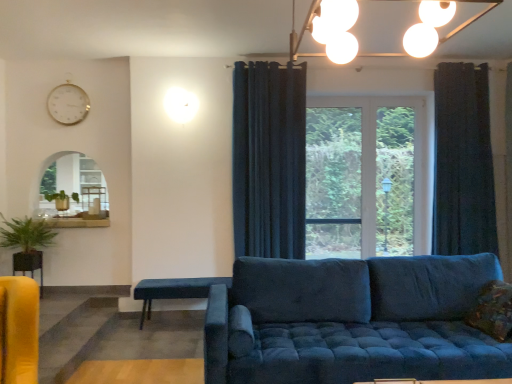
Question: Is the depth of dark blue textured curtain at right, which appears as the first curtain when viewed from the right, greater than that of textured brown pillow at lower right?

Choices:
 (A) yes
 (B) no

Answer: (A)

Question: Is dark blue textured curtain at right, which appears as the first curtain when viewed from the right, thinner than textured brown pillow at lower right?

Choices:
 (A) no
 (B) yes

Answer: (A)

Question: From the image's perspective, is dark blue textured curtain at right, which ranks as the 2th curtain in left-to-right order, below textured brown pillow at lower right?

Choices:
 (A) no
 (B) yes

Answer: (A)

Question: From a real-world perspective, is dark blue textured curtain at right, which ranks as the 2th curtain in left-to-right order, positioned over textured brown pillow at lower right based on gravity?

Choices:
 (A) no
 (B) yes

Answer: (B)

Question: Is dark blue textured curtain at right, which ranks as the 2th curtain in left-to-right order, at the left side of textured brown pillow at lower right?

Choices:
 (A) no
 (B) yes

Answer: (A)

Question: From the image's perspective, is textured brown pillow at lower right positioned above or below white glossy clock at upper left?

Choices:
 (A) above
 (B) below

Answer: (B)

Question: In the image, is textured brown pillow at lower right on the left side or the right side of white glossy clock at upper left?

Choices:
 (A) left
 (B) right

Answer: (B)

Question: Is textured brown pillow at lower right in front of or behind white glossy clock at upper left in the image?

Choices:
 (A) front
 (B) behind

Answer: (A)

Question: Considering the positions of textured brown pillow at lower right and white glossy clock at upper left in the image, is textured brown pillow at lower right taller or shorter than white glossy clock at upper left?

Choices:
 (A) short
 (B) tall

Answer: (A)

Question: Based on their sizes in the image, would you say velvet blue studio couch at center is bigger or smaller than matte yellow table at lower left, which is the third table from right to left?

Choices:
 (A) big
 (B) small

Answer: (A)

Question: Is velvet blue studio couch at center wider or thinner than matte yellow table at lower left, which appears as the second table when ordered from the bottom?

Choices:
 (A) thin
 (B) wide

Answer: (B)

Question: Is velvet blue studio couch at center inside the boundaries of matte yellow table at lower left, the 1th table viewed from the left, or outside?

Choices:
 (A) inside
 (B) outside

Answer: (B)

Question: In the image, is velvet blue studio couch at center positioned in front of or behind matte yellow table at lower left, acting as the second table starting from the back?

Choices:
 (A) behind
 (B) front

Answer: (B)

Question: Relative to matte white table at left, the 3th table in the bottom-to-top sequence, is dark blue fabric curtain at center, the second curtain positioned from the right, in front or behind?

Choices:
 (A) behind
 (B) front

Answer: (B)

Question: Would you say dark blue fabric curtain at center, placed as the first curtain when sorted from left to right, is to the left or to the right of matte white table at left, the 3th table in the bottom-to-top sequence, in the picture?

Choices:
 (A) left
 (B) right

Answer: (B)